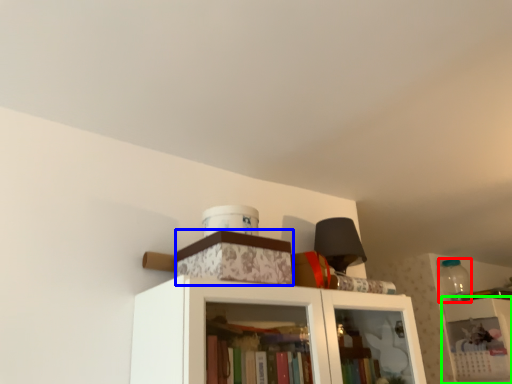
Question: Estimate the real-world distances between objects in this image. Which object is farther from bottle (highlighted by a red box), cabinetry (highlighted by a blue box) or shelf (highlighted by a green box)?

Choices:
 (A) cabinetry
 (B) shelf

Answer: (A)